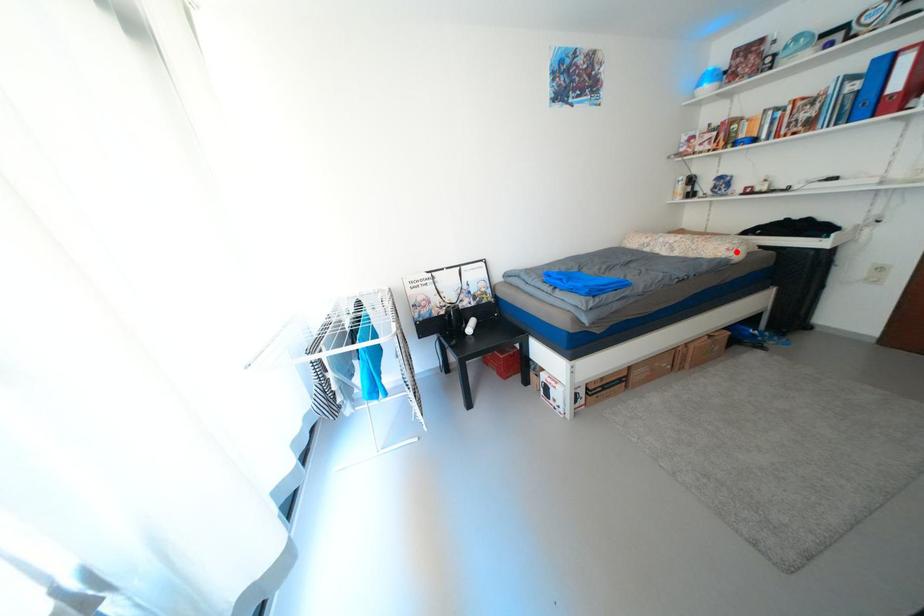
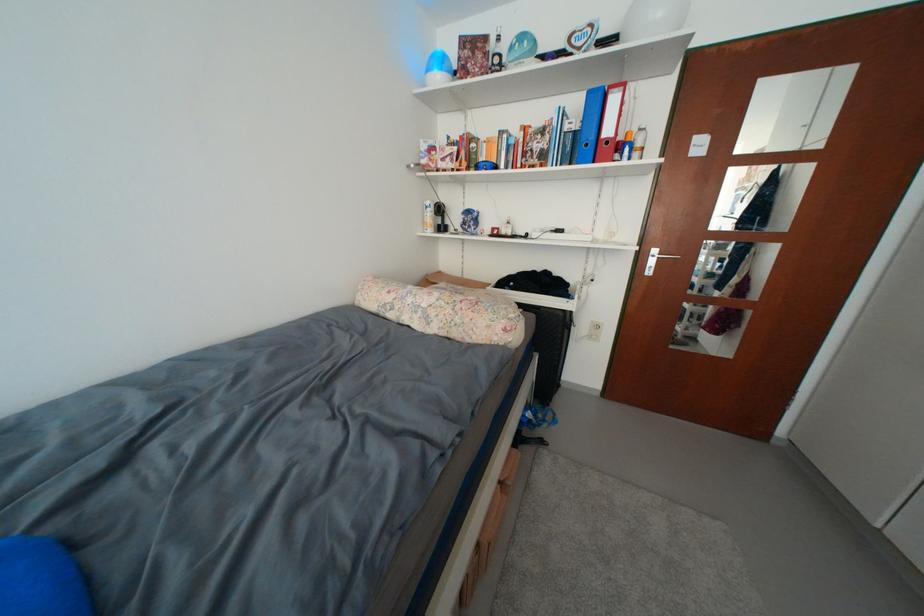
Find the pixel in the second image that matches the highlighted location in the first image.

(514, 331)